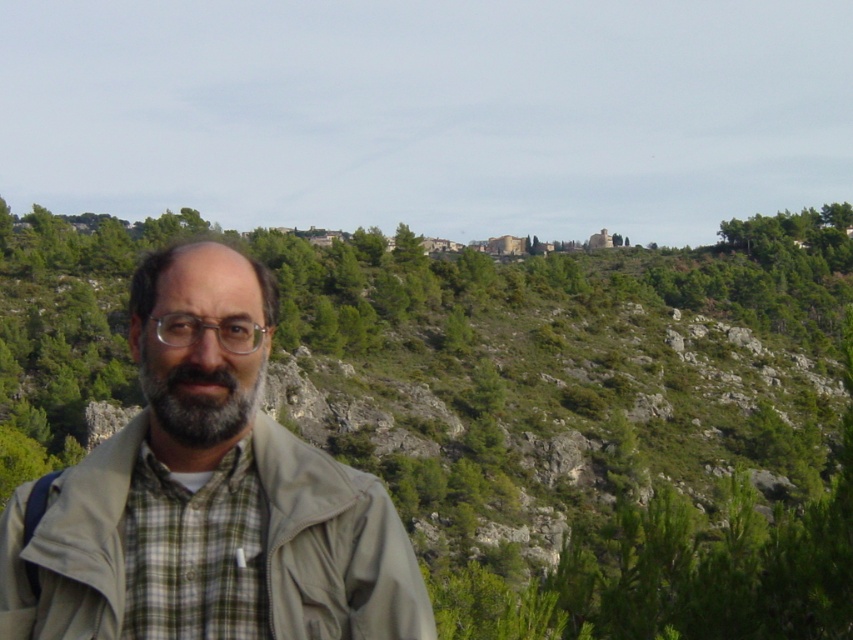
You are a fashion designer observing the man in the image. You need to determine the layering order of his clothing. Which item is visible on top, the beige fabric jacket at center or the green plaid shirt at center?

The beige fabric jacket at center is closer to the viewer than the green plaid shirt at center, so the beige fabric jacket at center is visible on top.

You are observing a man in the image. The man has a green plaid shirt at center and a gray matte beard at center. Which of these two items is larger in size?

The green plaid shirt at center is bigger than the gray matte beard at center.